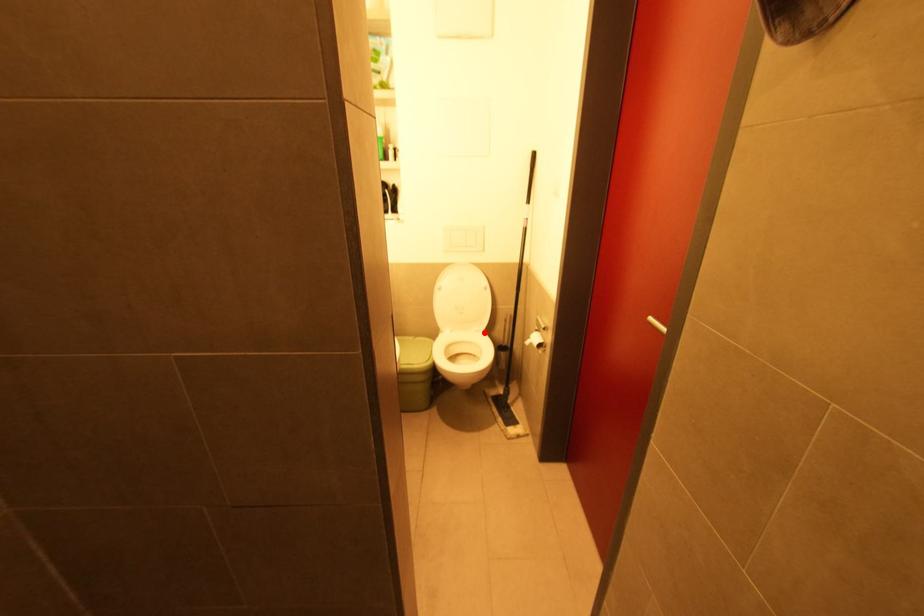
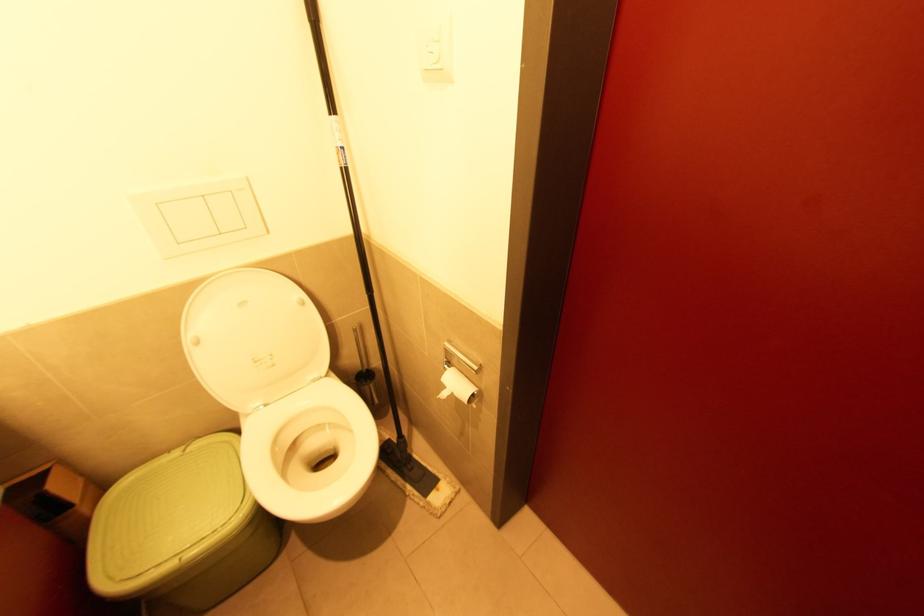
Find the pixel in the second image that matches the highlighted location in the first image.

(329, 377)